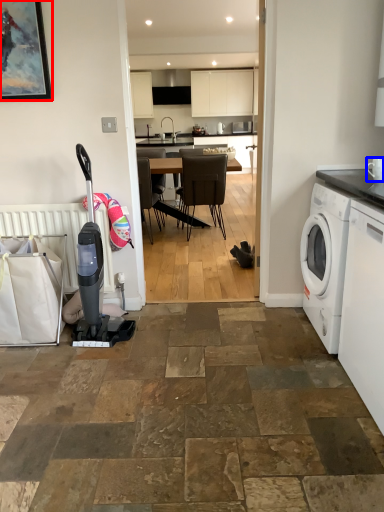
Question: Which point is closer to the camera, picture frame (highlighted by a red box) or appliance (highlighted by a blue box)?

Choices:
 (A) picture frame
 (B) appliance

Answer: (B)